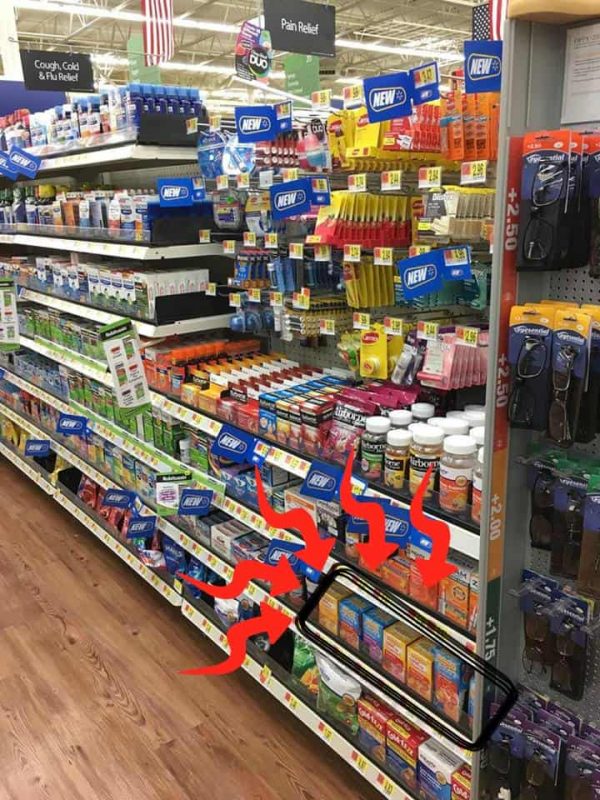
The image size is (600, 800). I want to click on support beams, so click(366, 22).